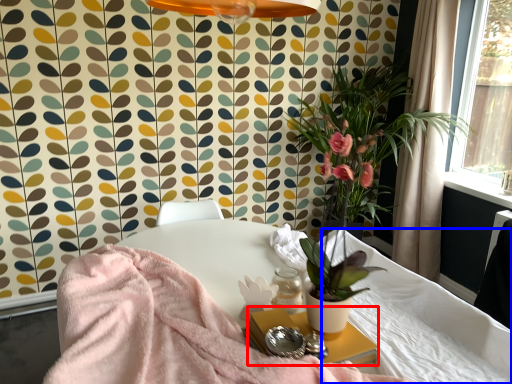
Question: Which object appears closest to the camera in this image, side table (highlighted by a red box) or mattress (highlighted by a blue box)?

Choices:
 (A) side table
 (B) mattress

Answer: (A)